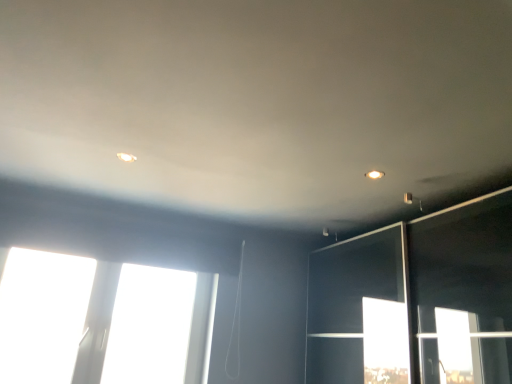
Locate an element on the screen. This screenshot has height=384, width=512. transparent glass window at upper left is located at coordinates (102, 321).

The image size is (512, 384). What do you see at coordinates (102, 321) in the screenshot? I see `transparent glass window at upper left` at bounding box center [102, 321].

The image size is (512, 384). Identify the location of transparent glass window at upper left. (102, 321).